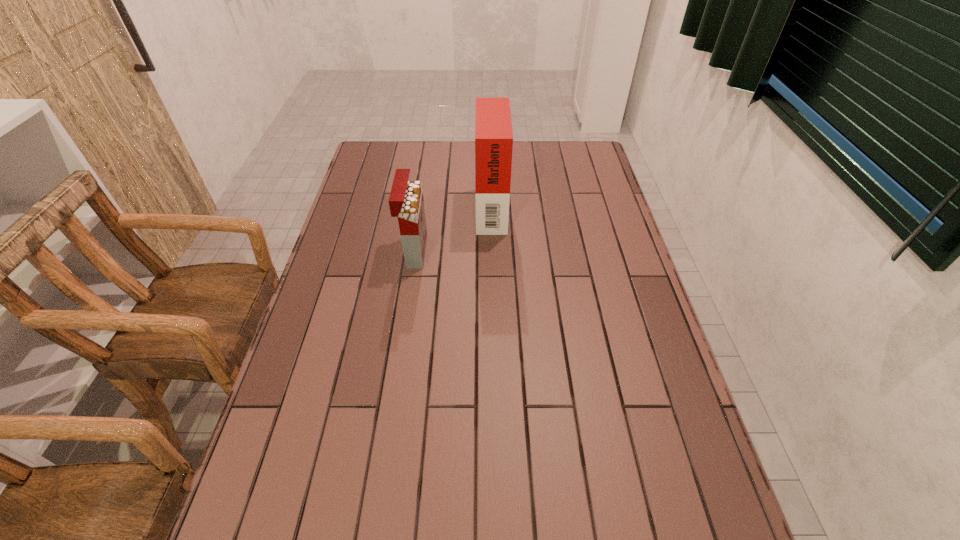
What are the coordinates of `the farther object` in the screenshot? It's located at (493, 129).

Where is `the right object`? the right object is located at coordinates (493, 129).

What are the coordinates of `the nearer object` in the screenshot? It's located at (406, 202).

This screenshot has width=960, height=540. Find the location of `the shorter cigarette case`. the shorter cigarette case is located at coordinates (406, 202).

This screenshot has height=540, width=960. I want to click on vacant space located 0.210m on the front-facing side of the right object, so click(x=416, y=205).

What are the coordinates of `vacant space situated on the front-facing side of the right object` in the screenshot? It's located at (384, 205).

Identify the location of vacant area situated on the front-facing side of the right object. (450, 205).

In order to click on vacant region located with the lid open on the nearer object in this screenshot , I will do (x=464, y=251).

Image resolution: width=960 pixels, height=540 pixels. Identify the location of vacant space at the far edge of the desktop. (514, 150).

Where is `free point at the left edge`? This screenshot has height=540, width=960. free point at the left edge is located at coordinates (357, 325).